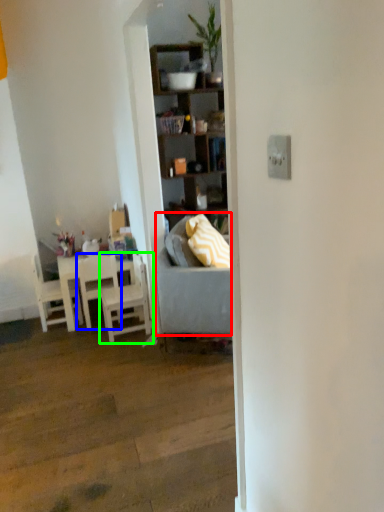
Question: Based on their relative distances, which object is farther from studio couch (highlighted by a red box)? Choose from chair (highlighted by a blue box) and chair (highlighted by a green box).

Choices:
 (A) chair
 (B) chair

Answer: (A)